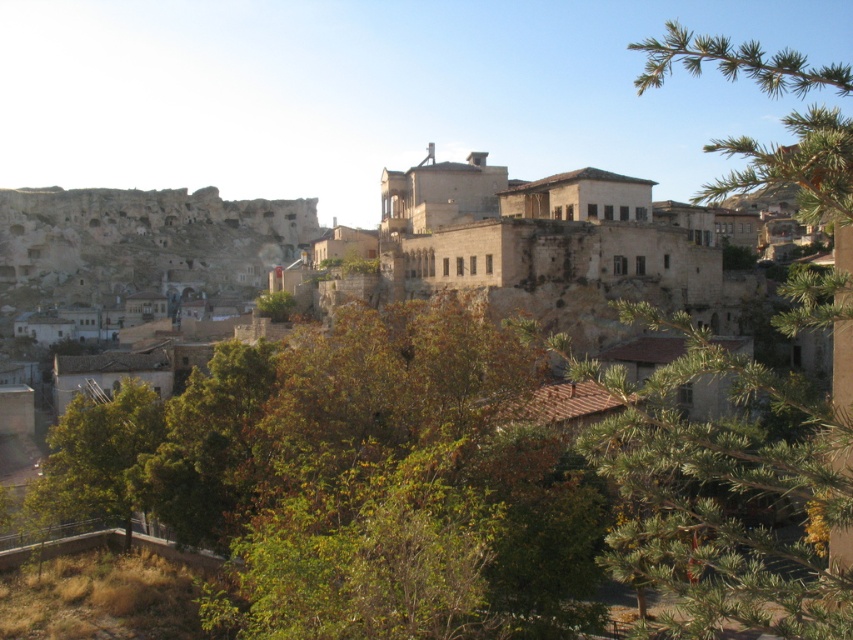
You are standing at the camera position and want to reach point (698, 35). Is the distance more than 500 meters?

The distance between point (698, 35) and the camera is 531.40 meters, which is more than 500 meters.

You are standing in the historic town and want to walk from point A to point B. Point A is located at coordinate point (408, 211) and point B is at coordinate point (99, 417). Which point is closer to you when you start walking?

Point A at coordinate point (408, 211) is closer to you than point B at coordinate point (99, 417) because it is further to the viewer.